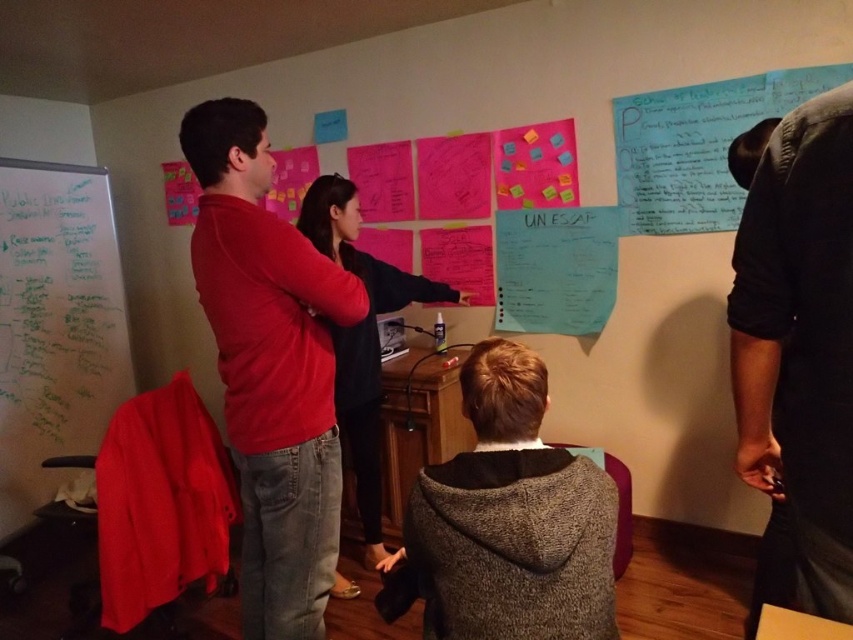
This screenshot has height=640, width=853. Describe the element at coordinates (270, 369) in the screenshot. I see `matte red shirt at center` at that location.

Does matte red shirt at center appear on the right side of whiteboard at left?

Correct, you'll find matte red shirt at center to the right of whiteboard at left.

Locate an element on the screen. This screenshot has width=853, height=640. matte red shirt at center is located at coordinates (270, 369).

What are the coordinates of `matte red shirt at center` in the screenshot? It's located at (270, 369).

Between point (48, 365) and point (575, 209), which one is positioned behind?

The point (48, 365) is more distant.

Is point (42, 220) in front of point (556, 220)?

No, (42, 220) is behind (556, 220).

Describe the element at coordinates (55, 324) in the screenshot. I see `whiteboard at left` at that location.

Locate an element on the screen. This screenshot has height=640, width=853. whiteboard at left is located at coordinates (55, 324).

Is dark gray hoodie at center thinner than white paper at center?

No.

Which is more to the left, dark gray hoodie at center or white paper at center?

From the viewer's perspective, dark gray hoodie at center appears more on the left side.

At what (x,y) coordinates should I click in order to perform the action: click on dark gray hoodie at center. Please return your answer as a coordinate pair (x, y). The width and height of the screenshot is (853, 640). Looking at the image, I should click on (511, 518).

Where is `dark gray hoodie at center`? This screenshot has height=640, width=853. dark gray hoodie at center is located at coordinates (511, 518).